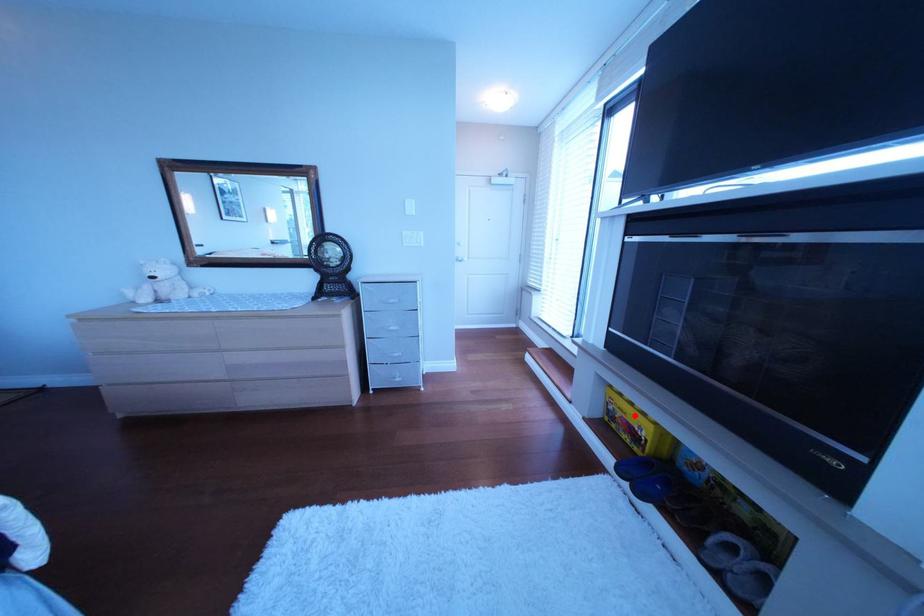
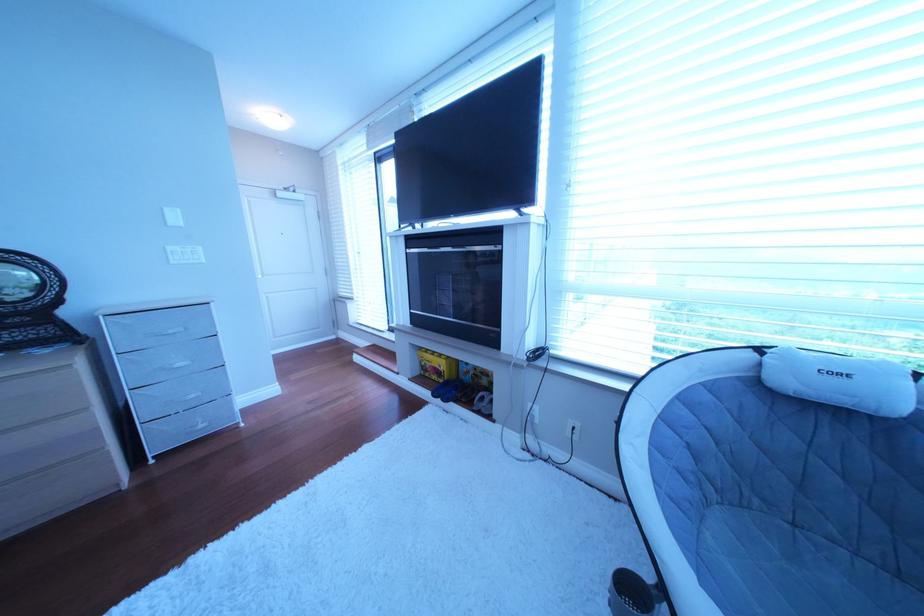
In the second image, find the point that corresponds to the highlighted location in the first image.

(444, 367)